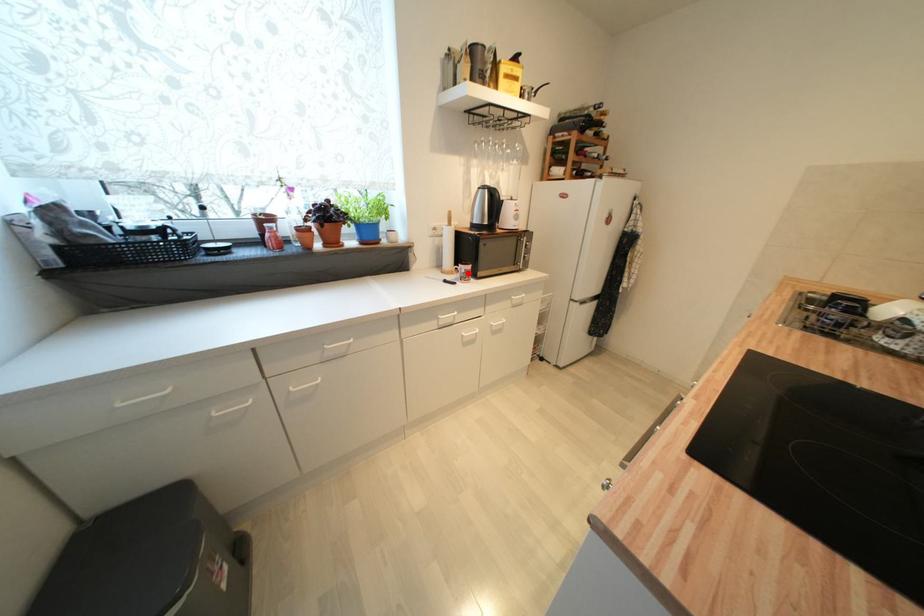
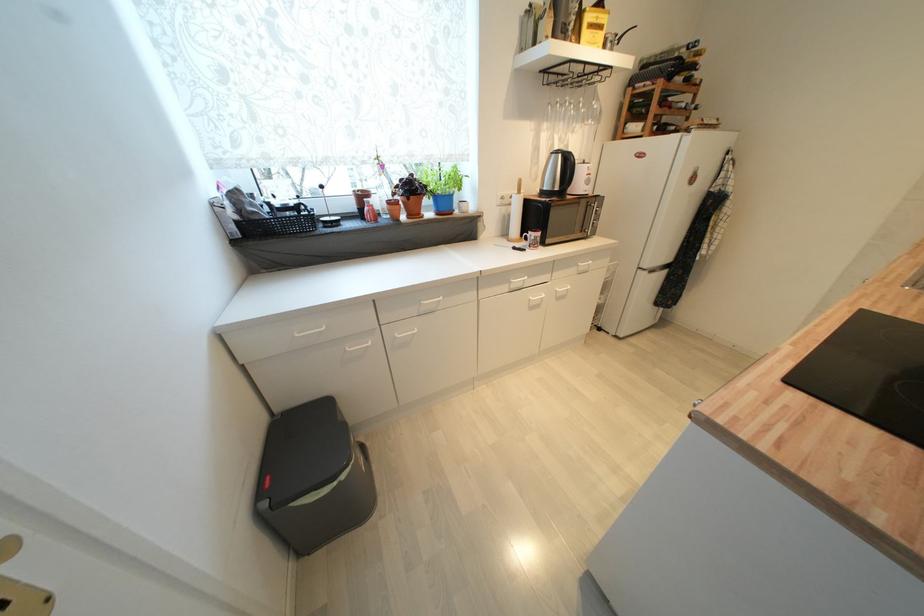
Find the pixel in the second image that matches the highlighted location in the first image.

(538, 240)